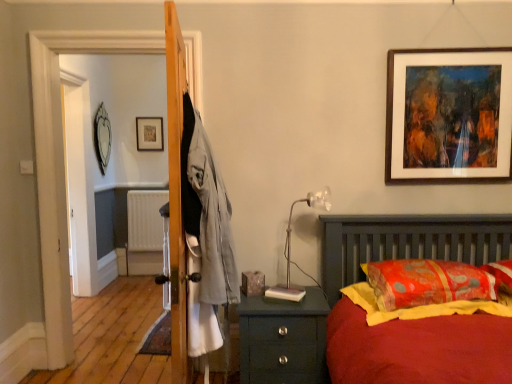
Question: Is orange fabric pillow at right bigger than translucent plastic table lamp at right?

Choices:
 (A) yes
 (B) no

Answer: (A)

Question: Considering the relative sizes of orange fabric pillow at right and translucent plastic table lamp at right in the image provided, is orange fabric pillow at right taller than translucent plastic table lamp at right?

Choices:
 (A) no
 (B) yes

Answer: (A)

Question: Is orange fabric pillow at right positioned before translucent plastic table lamp at right?

Choices:
 (A) no
 (B) yes

Answer: (B)

Question: Is translucent plastic table lamp at right located within orange fabric pillow at right?

Choices:
 (A) yes
 (B) no

Answer: (B)

Question: Is orange fabric pillow at right facing away from translucent plastic table lamp at right?

Choices:
 (A) no
 (B) yes

Answer: (A)

Question: Does orange fabric pillow at right have a lesser width compared to translucent plastic table lamp at right?

Choices:
 (A) yes
 (B) no

Answer: (B)

Question: Is wooden picture frame at upper center, the first picture frame viewed from the back, shorter than orange fabric pillow at right?

Choices:
 (A) yes
 (B) no

Answer: (B)

Question: Would you consider wooden picture frame at upper center, which is the second picture frame in left-to-right order, to be distant from orange fabric pillow at right?

Choices:
 (A) no
 (B) yes

Answer: (B)

Question: Would you say wooden picture frame at upper center, the first picture frame viewed from the back, contains orange fabric pillow at right?

Choices:
 (A) no
 (B) yes

Answer: (A)

Question: From a real-world perspective, is wooden picture frame at upper center, which is the 3th picture frame in front-to-back order, on top of orange fabric pillow at right?

Choices:
 (A) yes
 (B) no

Answer: (A)

Question: Are wooden picture frame at upper center, marked as the 2th picture frame in a right-to-left arrangement, and orange fabric pillow at right beside each other?

Choices:
 (A) no
 (B) yes

Answer: (A)

Question: Is wooden picture frame at upper center, which is the second picture frame in left-to-right order, not inside orange fabric pillow at right?

Choices:
 (A) no
 (B) yes

Answer: (B)

Question: From the image's perspective, is brown wooden picture frame at upper right, which appears as the third picture frame when viewed from the back, below orange fabric pillow at right?

Choices:
 (A) no
 (B) yes

Answer: (A)